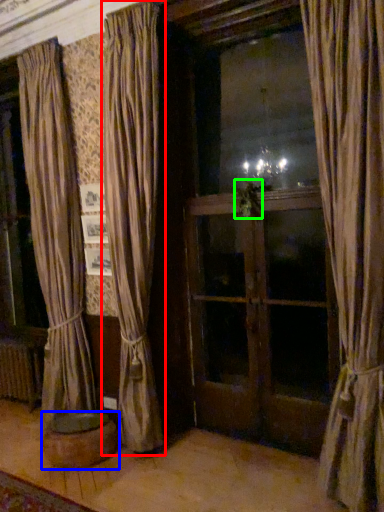
Question: Considering the real-world distances, which object is closest to curtain (highlighted by a red box)? furniture (highlighted by a blue box) or plant (highlighted by a green box).

Choices:
 (A) furniture
 (B) plant

Answer: (A)